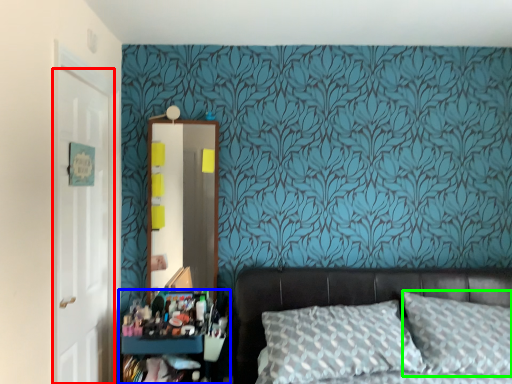
Question: Which object is the farthest from door (highlighted by a red box)? Choose among these: dresser (highlighted by a blue box) or pillow (highlighted by a green box).

Choices:
 (A) dresser
 (B) pillow

Answer: (B)